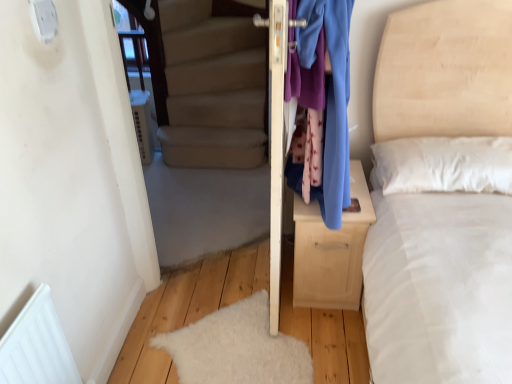
Locate an element on the screen. The height and width of the screenshot is (384, 512). blue fabric at right is located at coordinates (331, 96).

Find the location of a particular element. blue fabric at right is located at coordinates (331, 96).

Considering the sizes of objects white fluffy mat at lower left and blue fabric at right in the image provided, who is thinner, white fluffy mat at lower left or blue fabric at right?

With smaller width is blue fabric at right.

Could blue fabric at right be considered to be inside white fluffy mat at lower left?

No, blue fabric at right is not surrounded by white fluffy mat at lower left.

From the image's perspective, who appears lower, white fluffy mat at lower left or blue fabric at right?

white fluffy mat at lower left, from the image's perspective.

Is blue fabric at right positioned beyond the bounds of light wood/texture nightstand at center?

blue fabric at right lies outside light wood/texture nightstand at center's area.

Looking at this image, from the image's perspective, which one is positioned lower, blue fabric at right or light wood/texture nightstand at center?

From the image's view, light wood/texture nightstand at center is below.

Is the position of blue fabric at right less distant than that of light wood/texture nightstand at center?

Yes, blue fabric at right is in front of light wood/texture nightstand at center.

From a real-world perspective, is blue fabric at right positioned over light wood/texture nightstand at center based on gravity?

Yes, from a real-world perspective, blue fabric at right is on top of light wood/texture nightstand at center.

Find the location of a particular element. nightstand in front of the white fluffy mat at lower left is located at coordinates (331, 251).

Considering the relative sizes of white fluffy mat at lower left and light wood/texture nightstand at center in the image provided, is white fluffy mat at lower left wider than light wood/texture nightstand at center?

Correct, the width of white fluffy mat at lower left exceeds that of light wood/texture nightstand at center.

Is white fluffy mat at lower left positioned beyond the bounds of light wood/texture nightstand at center?

Indeed, white fluffy mat at lower left is completely outside light wood/texture nightstand at center.

From the image's perspective, between white fluffy mat at lower left and light wood/texture nightstand at center, who is located below?

white fluffy mat at lower left appears lower in the image.

Is blue fabric at right to the right of white fluffy mat at lower left from the viewer's perspective?

Yes, blue fabric at right is to the right of white fluffy mat at lower left.

From the picture: Is blue fabric at right taller than white fluffy mat at lower left?

Yes, blue fabric at right is taller than white fluffy mat at lower left.

Is blue fabric at right positioned beyond the bounds of white fluffy mat at lower left?

Yes, blue fabric at right is outside of white fluffy mat at lower left.

From the image's perspective, which is below, blue fabric at right or white fluffy mat at lower left?

white fluffy mat at lower left, from the image's perspective.

Identify the location of nightstand that is above the white fluffy mat at lower left (from the image's perspective). The image size is (512, 384). (331, 251).

Considering the relative sizes of light wood/texture nightstand at center and white fluffy mat at lower left in the image provided, is light wood/texture nightstand at center taller than white fluffy mat at lower left?

Correct, light wood/texture nightstand at center is much taller as white fluffy mat at lower left.

Is light wood/texture nightstand at center surrounding white fluffy mat at lower left?

Actually, white fluffy mat at lower left is outside light wood/texture nightstand at center.

Is point (315, 231) farther from viewer compared to point (190, 362)?

Yes, point (315, 231) is behind point (190, 362).

What's the angular difference between light wood/texture nightstand at center and blue fabric at right's facing directions?

89.9 degrees.

Is light wood/texture nightstand at center positioned beyond the bounds of blue fabric at right?

Indeed, light wood/texture nightstand at center is completely outside blue fabric at right.

Which object is positioned more to the right, light wood/texture nightstand at center or blue fabric at right?

From the viewer's perspective, light wood/texture nightstand at center appears more on the right side.

Considering the positions of objects light wood/texture nightstand at center and blue fabric at right in the image provided, who is in front, light wood/texture nightstand at center or blue fabric at right?

blue fabric at right is in front.

I want to click on clothing lying in front of the white fluffy mat at lower left, so click(331, 96).

Locate an element on the screen. This screenshot has width=512, height=384. clothing above the light wood/texture nightstand at center (from the image's perspective) is located at coordinates (331, 96).

Considering their positions, is light wood/texture nightstand at center positioned closer to blue fabric at right than white fluffy mat at lower left?

light wood/texture nightstand at center is closer to blue fabric at right.

Considering their positions, is light wood/texture nightstand at center positioned closer to white fluffy mat at lower left than blue fabric at right?

light wood/texture nightstand at center is positioned closer to the anchor white fluffy mat at lower left.

Which object lies further to the anchor point white fluffy mat at lower left, blue fabric at right or light wood/texture nightstand at center?

blue fabric at right is further to white fluffy mat at lower left.

When comparing their distances from blue fabric at right, does white fluffy mat at lower left or light wood/texture nightstand at center seem further?

white fluffy mat at lower left is positioned further to the anchor blue fabric at right.

Considering their positions, is white fluffy mat at lower left positioned closer to light wood/texture nightstand at center than blue fabric at right?

blue fabric at right is closer to light wood/texture nightstand at center.

Considering their positions, is blue fabric at right positioned closer to light wood/texture nightstand at center than white fluffy mat at lower left?

Among the two, blue fabric at right is located nearer to light wood/texture nightstand at center.

Where is `nightstand between blue fabric at right and white fluffy mat at lower left in the vertical direction`? This screenshot has width=512, height=384. nightstand between blue fabric at right and white fluffy mat at lower left in the vertical direction is located at coordinates tap(331, 251).